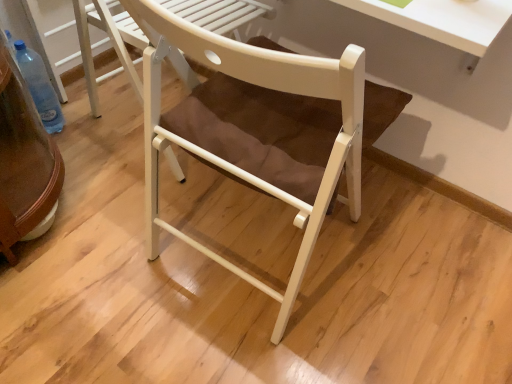
Where is `vacant region to the left of white wood chair at center, which is counted as the second chair, starting from the back`? The height and width of the screenshot is (384, 512). vacant region to the left of white wood chair at center, which is counted as the second chair, starting from the back is located at coordinates (104, 246).